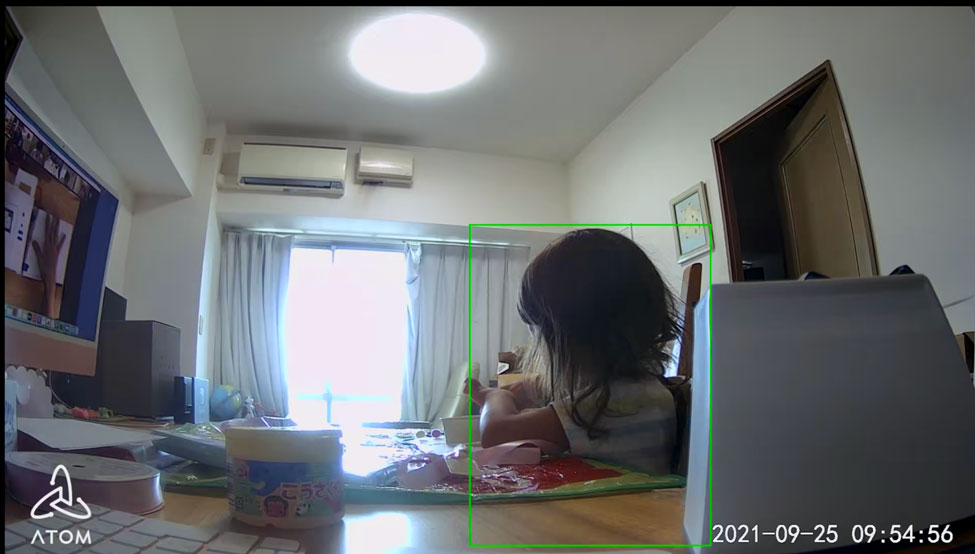
At what (x,y) coordinates should I click in order to perform the action: click on computer. Please return your answer as a coordinate pair (x, y). Looking at the image, I should click on (34, 258).